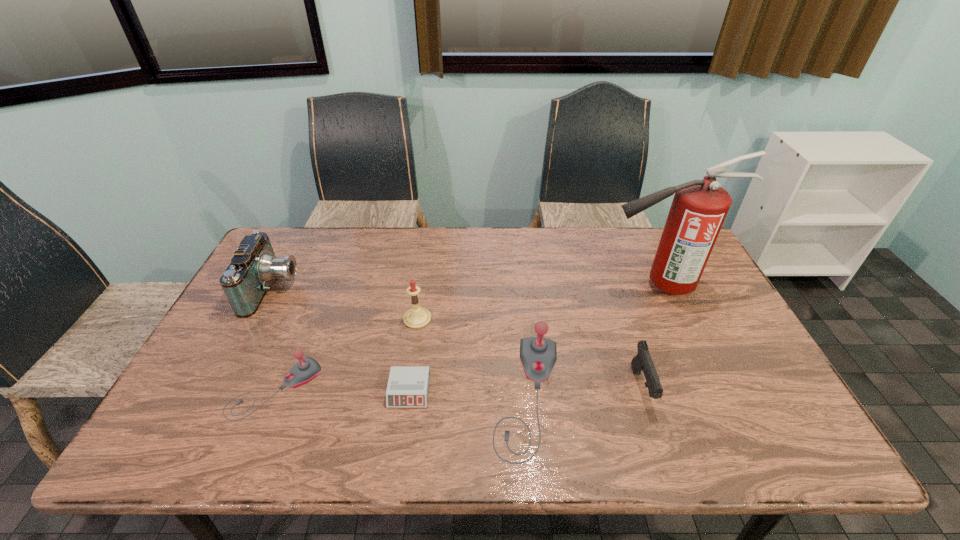
Locate an element on the screen. blank space at the far right corner of the desktop is located at coordinates (655, 257).

Locate an element on the screen. The height and width of the screenshot is (540, 960). vacant space at the near right corner is located at coordinates (763, 412).

Find the location of a particular element. The height and width of the screenshot is (540, 960). empty space that is in between the shortest object and the candle is located at coordinates (413, 355).

I want to click on vacant point located between the candle and the shorter joystick, so click(347, 354).

Where is `unoccupied position between the shortest object and the sixth tallest object`? Image resolution: width=960 pixels, height=540 pixels. unoccupied position between the shortest object and the sixth tallest object is located at coordinates (343, 390).

Where is `empty location between the camcorder and the right joystick`? This screenshot has height=540, width=960. empty location between the camcorder and the right joystick is located at coordinates (400, 343).

In order to click on vacant space that is in between the alarm clock and the candle in this screenshot , I will do `click(413, 355)`.

The width and height of the screenshot is (960, 540). Find the location of `blank region between the fire extinguisher and the candle`. blank region between the fire extinguisher and the candle is located at coordinates (538, 302).

This screenshot has width=960, height=540. What are the coordinates of `free spot between the left joystick and the fire extinguisher` in the screenshot? It's located at (468, 337).

Image resolution: width=960 pixels, height=540 pixels. I want to click on free space between the shortest object and the candle, so click(x=413, y=355).